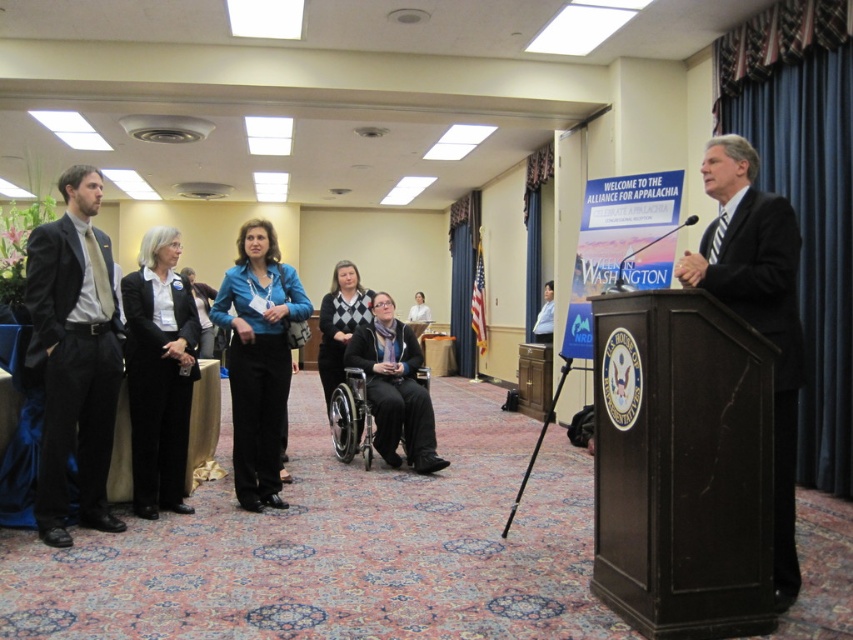
Question: Which point is farther to the camera?

Choices:
 (A) dark suit at right
 (B) matte black suit at left
 (C) black fabric jacket at left

Answer: (C)

Question: Which of the following is the farthest from the observer?

Choices:
 (A) (361, 305)
 (B) (257, 225)
 (C) (788, 276)
 (D) (73, 243)

Answer: (A)

Question: Can you confirm if matte black suit at left is positioned below matte blue blazer at center?

Choices:
 (A) no
 (B) yes

Answer: (A)

Question: Can you confirm if black fabric jacket at left is positioned above dark gray sweater at center?

Choices:
 (A) yes
 (B) no

Answer: (B)

Question: Observing the image, what is the correct spatial positioning of matte blue blazer at center in reference to dark gray sweater at center?

Choices:
 (A) above
 (B) below

Answer: (B)

Question: Which is nearer to the black fabric jacket at left?

Choices:
 (A) dark suit at right
 (B) matte black suit at left
 (C) matte blue blazer at center
 (D) metallic silver wheelchair at center

Answer: (B)